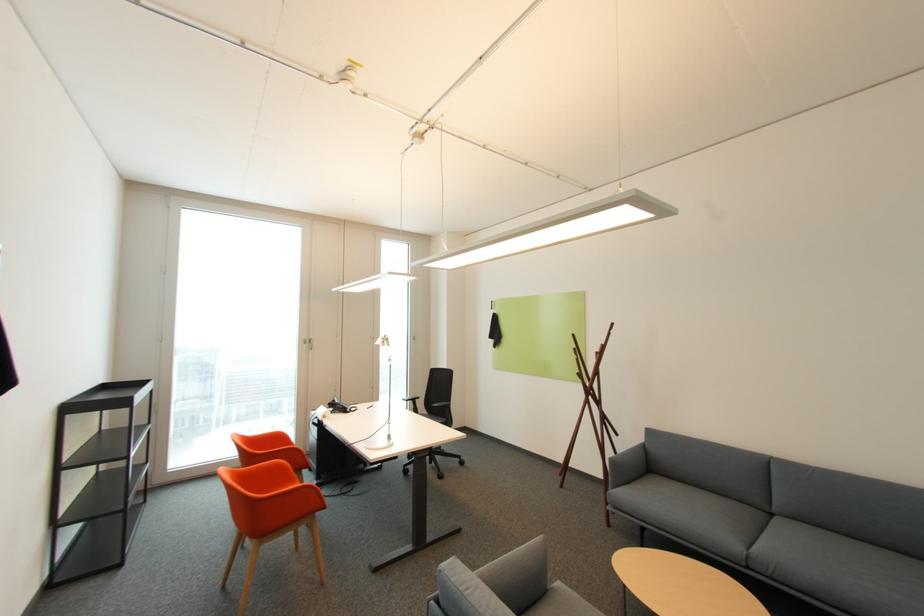
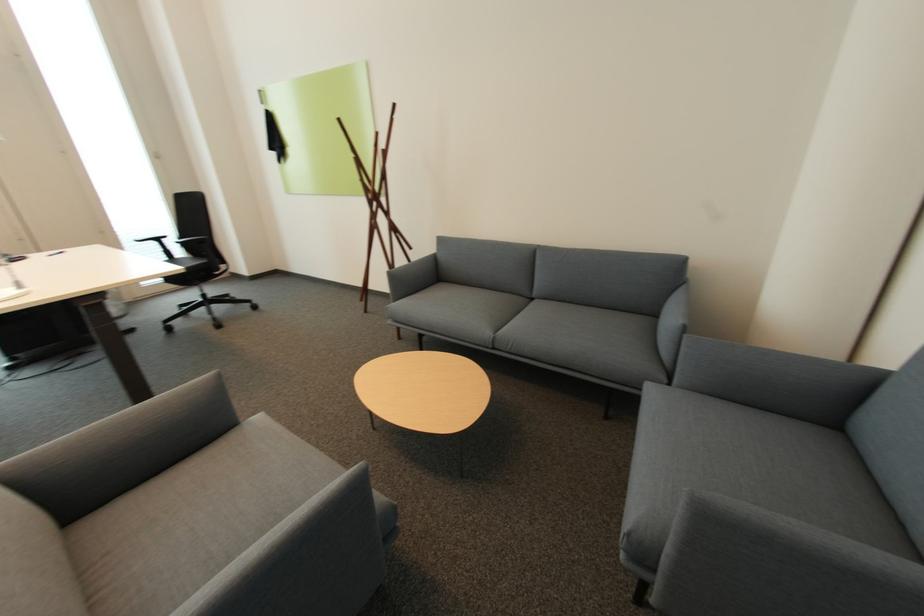
Locate, in the second image, the point that corresponds to point 616,493 in the first image.

(394, 308)